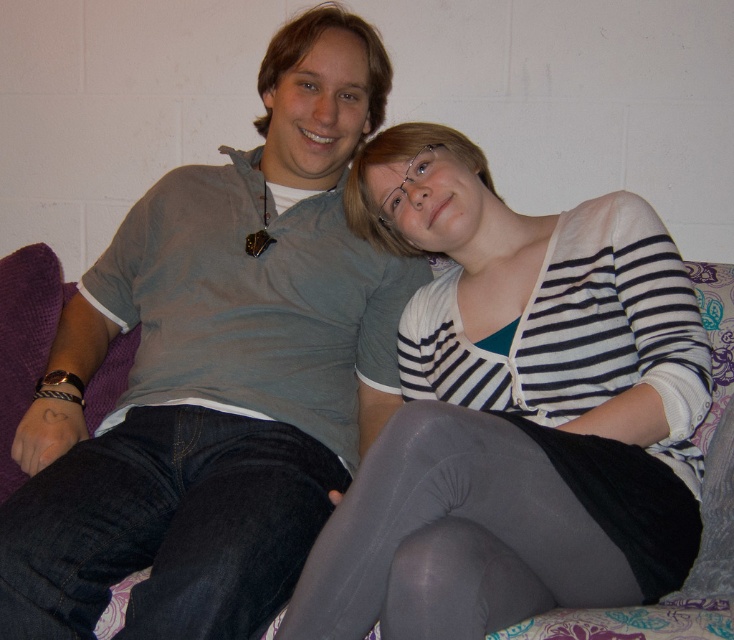
Is point (426, 444) behind point (294, 563)?

No, it is not.

Is point (643, 429) closer to camera compared to point (170, 624)?

No, it is not.

Find the location of `striped knit cardigan at center`. striped knit cardigan at center is located at coordinates (515, 410).

Which of these two, striped knit cardigan at center or gray tights at lower center, stands shorter?

With less height is gray tights at lower center.

Which is more to the left, striped knit cardigan at center or gray tights at lower center?

From the viewer's perspective, gray tights at lower center appears more on the left side.

Is point (324, 524) behind point (440, 429)?

Yes, point (324, 524) is farther from viewer.

Locate an element on the screen. This screenshot has height=640, width=734. striped knit cardigan at center is located at coordinates (515, 410).

Does dark blue denim jeans at lower left appear over gray tights at lower center?

Incorrect, dark blue denim jeans at lower left is not positioned above gray tights at lower center.

Who is more forward, (170, 588) or (493, 416)?

Point (170, 588) is in front.

Identify the location of dark blue denim jeans at lower left. (164, 525).